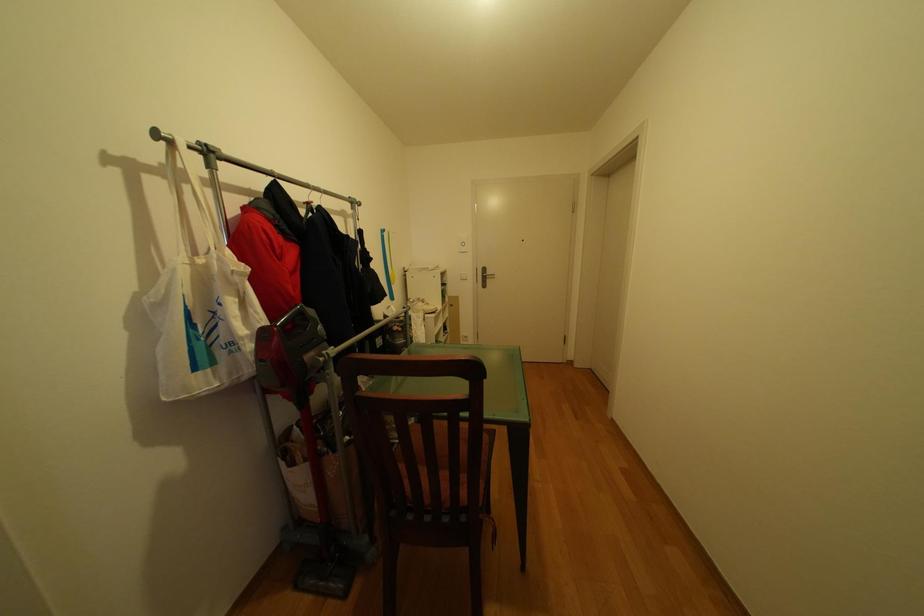
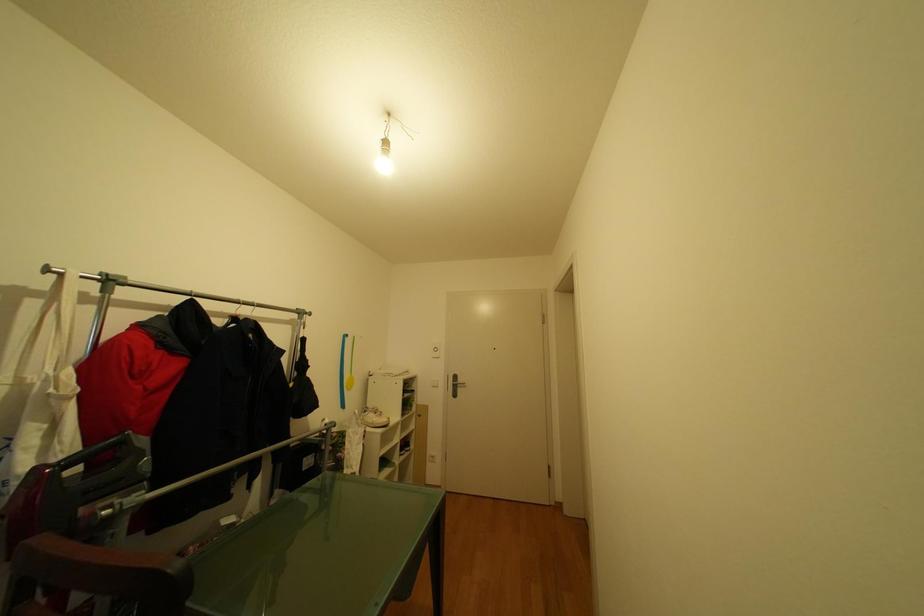
Question: Which direction would the cameraman need to move to produce the second image? Reply with the corresponding letter.

Choices:
 (A) Left
 (B) Right
 (C) Forward
 (D) Backward

Answer: (B)